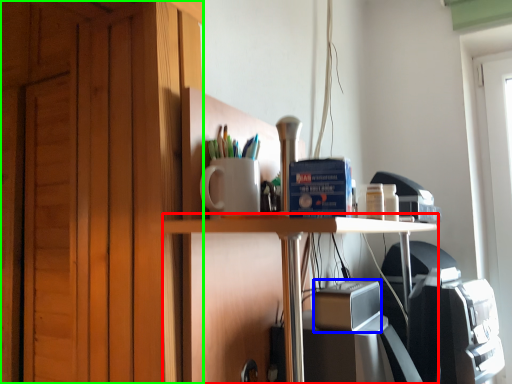
Question: Based on their relative distances, which object is nearer to table (highlighted by a red box)? Choose from appliance (highlighted by a blue box) and dresser (highlighted by a green box).

Choices:
 (A) appliance
 (B) dresser

Answer: (A)